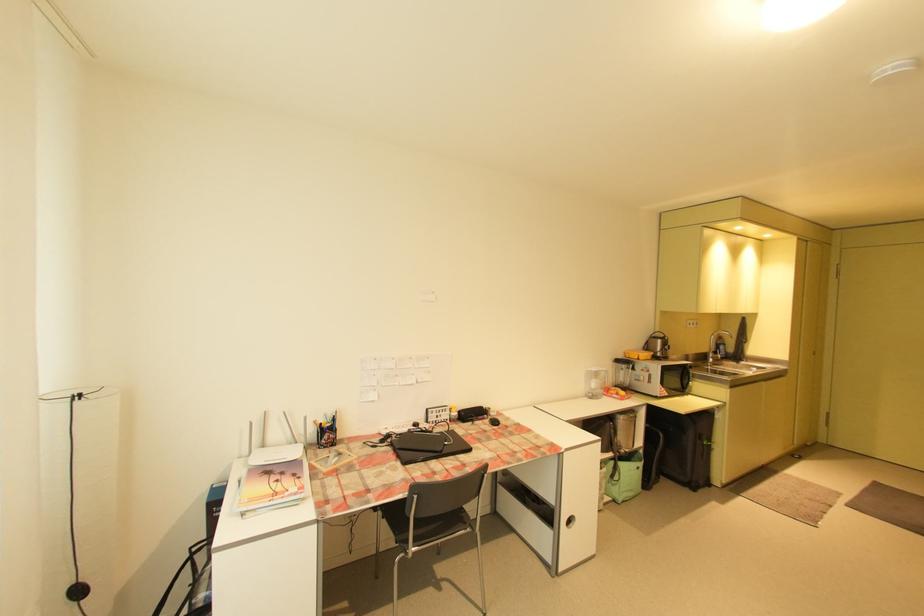
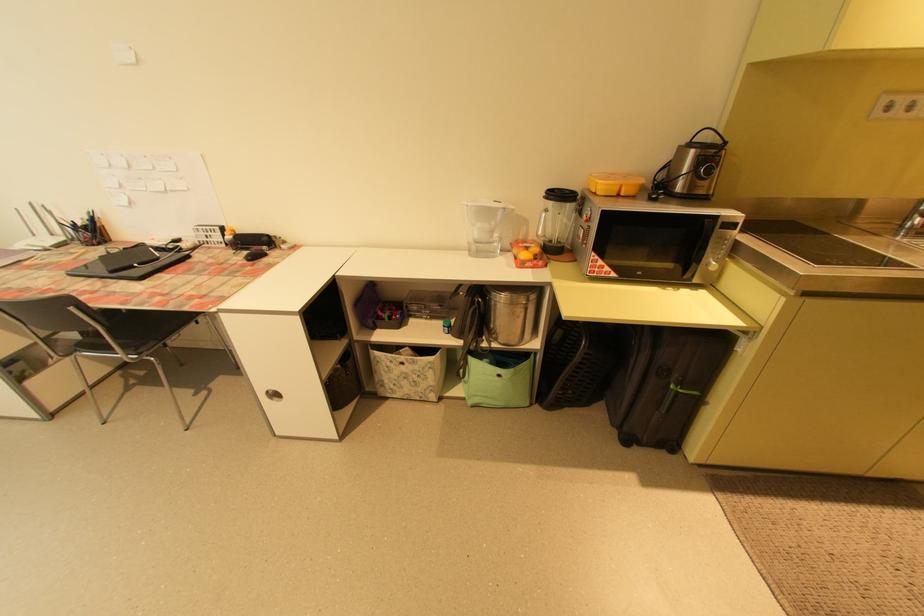
The point at [613,371] is marked in the first image. Where is the corresponding point in the second image?

(511, 209)